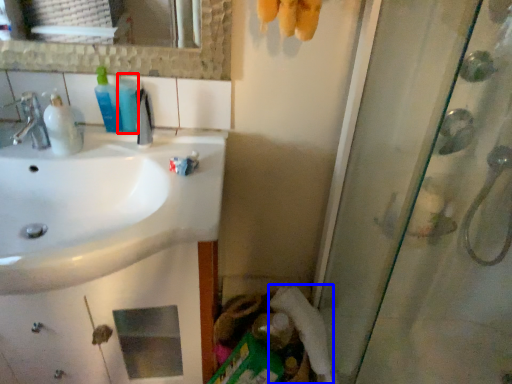
Question: Which object appears closest to the camera in this image, mouthwash (highlighted by a red box) or toilet paper (highlighted by a blue box)?

Choices:
 (A) mouthwash
 (B) toilet paper

Answer: (A)